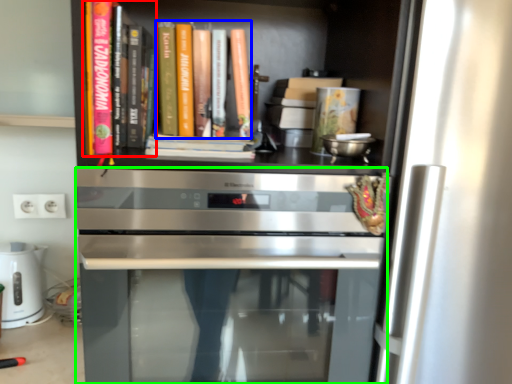
Question: Which object is positioned farthest from book (highlighted by a red box)? Select from book (highlighted by a blue box) and oven (highlighted by a green box).

Choices:
 (A) book
 (B) oven

Answer: (B)